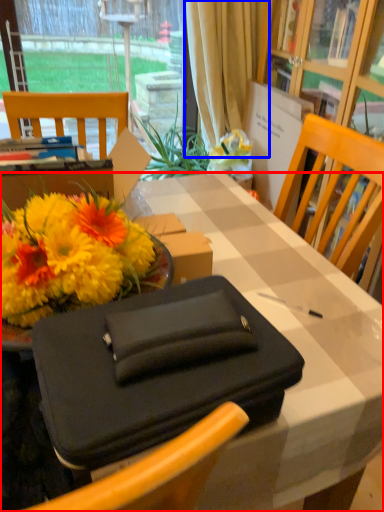
Question: Which object is closer to the camera taking this photo, desk (highlighted by a red box) or curtain (highlighted by a blue box)?

Choices:
 (A) desk
 (B) curtain

Answer: (A)